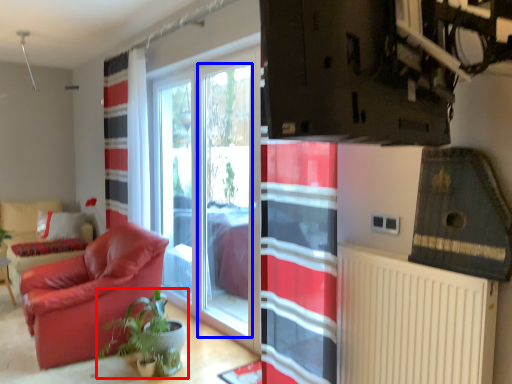
Question: Which object is closer to the camera taking this photo, houseplant (highlighted by a red box) or window screen (highlighted by a blue box)?

Choices:
 (A) houseplant
 (B) window screen

Answer: (A)